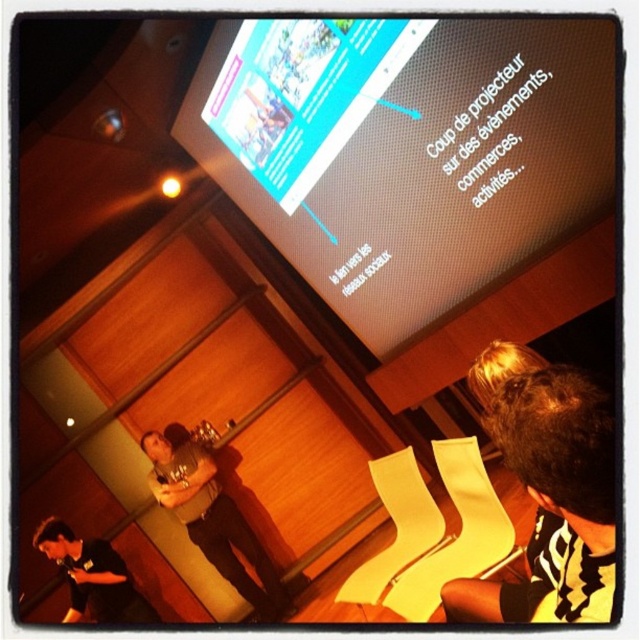
Question: Does dark brown hair at lower right appear on the right side of brown leather jacket at lower left?

Choices:
 (A) yes
 (B) no

Answer: (A)

Question: Which of the following is the closest to the observer?

Choices:
 (A) (93, 595)
 (B) (253, 564)
 (C) (573, 435)

Answer: (C)

Question: Does matte black screen at upper center lie in front of dark brown hair at lower right?

Choices:
 (A) yes
 (B) no

Answer: (B)

Question: Which object is positioned farthest from the brown leather jacket at lower left?

Choices:
 (A) matte black screen at upper center
 (B) black shirt at lower left
 (C) dark brown hair at lower right

Answer: (C)

Question: Can you confirm if brown leather jacket at lower left is positioned above black shirt at lower left?

Choices:
 (A) yes
 (B) no

Answer: (A)

Question: Which of the following is the closest to the observer?

Choices:
 (A) brown leather jacket at lower left
 (B) dark brown hair at lower right

Answer: (B)